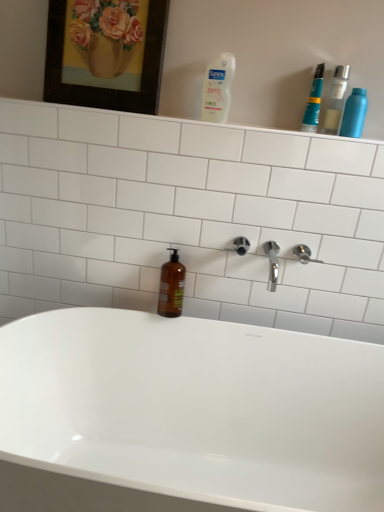
The height and width of the screenshot is (512, 384). I want to click on teal plastic toothpaste at upper right, the third mouthwash when ordered from bottom to top, so click(x=314, y=101).

Locate an element on the screen. white plastic bottle at upper center, which is the 1th cleaning product from left to right is located at coordinates (218, 88).

Describe the element at coordinates (171, 287) in the screenshot. I see `brown glass bottle at center, the first mouthwash in the bottom-to-top sequence` at that location.

What are the coordinates of `transparent plastic bottle at upper right, positioned as the second mouthwash in bottom-to-top order` in the screenshot? It's located at (336, 100).

From the image's perspective, is white plastic bottle at upper center, which is the 1th cleaning product from left to right, above white glossy shelf at upper center?

Indeed, from the image's perspective, white plastic bottle at upper center, which is the 1th cleaning product from left to right, is shown above white glossy shelf at upper center.

From a real-world perspective, which object rests below the other?

white glossy shelf at upper center is physically lower.

Looking at this image, can you confirm if white plastic bottle at upper center, which is the 1th cleaning product from left to right, is taller than white glossy shelf at upper center?

Indeed, white plastic bottle at upper center, which is the 1th cleaning product from left to right, has a greater height compared to white glossy shelf at upper center.

Which object is closer to the camera, white plastic bottle at upper center, which is the second cleaning product in right-to-left order, or white glossy shelf at upper center?

Positioned in front is white plastic bottle at upper center, which is the second cleaning product in right-to-left order.

From a real-world perspective, is white glossy bathtub at center beneath teal plastic toothpaste at upper right, the second mouthwash from the right?

Yes, from a real-world perspective, white glossy bathtub at center is below teal plastic toothpaste at upper right, the second mouthwash from the right.

Is white glossy bathtub at center oriented away from teal plastic toothpaste at upper right, the third mouthwash when ordered from bottom to top?

No, white glossy bathtub at center is not facing the opposite direction of teal plastic toothpaste at upper right, the third mouthwash when ordered from bottom to top.

Considering the sizes of objects white glossy bathtub at center and teal plastic toothpaste at upper right, the second mouthwash from the right, in the image provided, who is smaller, white glossy bathtub at center or teal plastic toothpaste at upper right, the second mouthwash from the right,?

With smaller size is teal plastic toothpaste at upper right, the second mouthwash from the right.

Looking at this image, based on their positions, is white plastic bottle at upper center, which is the 1th cleaning product from left to right, located to the left or right of white glossy bathtub at center?

white plastic bottle at upper center, which is the 1th cleaning product from left to right, is positioned on white glossy bathtub at center's right side.

Does white plastic bottle at upper center, which is the second cleaning product in right-to-left order, have a smaller size compared to white glossy bathtub at center?

Yes.

Is white glossy bathtub at center a part of white plastic bottle at upper center, which is the second cleaning product in right-to-left order?

Actually, white glossy bathtub at center is outside white plastic bottle at upper center, which is the second cleaning product in right-to-left order.

Are white plastic bottle at upper center, which is the 1th cleaning product from left to right, and white glossy bathtub at center located far from each other?

No, white plastic bottle at upper center, which is the 1th cleaning product from left to right, is not far away from white glossy bathtub at center.

In terms of width, does white plastic bottle at upper center, which is the second cleaning product in right-to-left order, look wider or thinner when compared to teal plastic toothpaste at upper right, the second mouthwash from the right?

Clearly, white plastic bottle at upper center, which is the second cleaning product in right-to-left order, has less width compared to teal plastic toothpaste at upper right, the second mouthwash from the right.

Who is more distant, white plastic bottle at upper center, which is the 1th cleaning product from left to right, or teal plastic toothpaste at upper right, which is counted as the 2th mouthwash, starting from the left?

teal plastic toothpaste at upper right, which is counted as the 2th mouthwash, starting from the left, is behind.

Is white plastic bottle at upper center, which is the second cleaning product in right-to-left order, located outside teal plastic toothpaste at upper right, the second mouthwash from the right?

Indeed, white plastic bottle at upper center, which is the second cleaning product in right-to-left order, is completely outside teal plastic toothpaste at upper right, the second mouthwash from the right.

From the image's perspective, does white plastic bottle at upper center, which is the second cleaning product in right-to-left order, appear lower than teal plastic toothpaste at upper right, the second mouthwash from the right?

No, from the image's perspective, white plastic bottle at upper center, which is the second cleaning product in right-to-left order, is not beneath teal plastic toothpaste at upper right, the second mouthwash from the right.

Who is taller, brown glass bottle at center, the first mouthwash in the bottom-to-top sequence, or wooden frame at upper left?

wooden frame at upper left.

Could wooden frame at upper left be considered to be inside brown glass bottle at center, placed as the first mouthwash when sorted from left to right?

No, wooden frame at upper left is not inside brown glass bottle at center, placed as the first mouthwash when sorted from left to right.

Who is more distant, brown glass bottle at center, the first mouthwash in the bottom-to-top sequence, or wooden frame at upper left?

brown glass bottle at center, the first mouthwash in the bottom-to-top sequence.

Between transparent plastic bottle at upper right, marked as the second mouthwash in a top-to-bottom arrangement, and white glossy shelf at upper center, which one is positioned in front?

transparent plastic bottle at upper right, marked as the second mouthwash in a top-to-bottom arrangement, is closer to the camera.

Considering the relative sizes of transparent plastic bottle at upper right, marked as the second mouthwash in a top-to-bottom arrangement, and white glossy shelf at upper center in the image provided, is transparent plastic bottle at upper right, marked as the second mouthwash in a top-to-bottom arrangement, thinner than white glossy shelf at upper center?

Indeed, transparent plastic bottle at upper right, marked as the second mouthwash in a top-to-bottom arrangement, has a lesser width compared to white glossy shelf at upper center.

Does point (327, 124) come closer to viewer compared to point (34, 106)?

Yes.

Can you see transparent plastic bottle at upper right, positioned as the second mouthwash in bottom-to-top order, touching white glossy shelf at upper center?

transparent plastic bottle at upper right, positioned as the second mouthwash in bottom-to-top order, and white glossy shelf at upper center are not in contact.

Does transparent plastic bottle at upper right, the third mouthwash positioned from the left, have a lesser height compared to wooden frame at upper left?

Correct, transparent plastic bottle at upper right, the third mouthwash positioned from the left, is not as tall as wooden frame at upper left.

Consider the image. Does transparent plastic bottle at upper right, marked as the second mouthwash in a top-to-bottom arrangement, have a larger size compared to wooden frame at upper left?

No, transparent plastic bottle at upper right, marked as the second mouthwash in a top-to-bottom arrangement, is not bigger than wooden frame at upper left.

Would you say transparent plastic bottle at upper right, the first mouthwash from the right, is to the left or to the right of wooden frame at upper left in the picture?

transparent plastic bottle at upper right, the first mouthwash from the right, is to the right of wooden frame at upper left.

You are a GUI agent. You are given a task and a screenshot of the screen. Output one action in this format:
    pyautogui.click(x=<x>, y=<y>)
    Task: Click on the shelve on the left of white plastic bottle at upper center, which is the second cleaning product in right-to-left order
    
    Given the screenshot: What is the action you would take?
    pyautogui.click(x=40, y=105)

The height and width of the screenshot is (512, 384). I want to click on mouthwash that is the 3rd object located above the white glossy bathtub at center (from the image's perspective), so click(x=314, y=101).

When comparing their distances from wooden frame at upper left, does white glossy bathtub at center or teal plastic toothpaste at upper right, the second mouthwash from the right, seem closer?

The object closer to wooden frame at upper left is teal plastic toothpaste at upper right, the second mouthwash from the right.

Considering their positions, is white plastic bottle at upper center, which is the second cleaning product in right-to-left order, positioned further to teal plastic toothpaste at upper right, marked as the 1th mouthwash in a top-to-bottom arrangement, than transparent plastic bottle at upper right, marked as the second mouthwash in a top-to-bottom arrangement?

Among the two, white plastic bottle at upper center, which is the second cleaning product in right-to-left order, is located further to teal plastic toothpaste at upper right, marked as the 1th mouthwash in a top-to-bottom arrangement.

From the image, which object appears to be nearer to white glossy bathtub at center, satin nickel shower at upper right or transparent plastic bottle at upper right, the third mouthwash positioned from the left?

satin nickel shower at upper right is closer to white glossy bathtub at center.

From the image, which object appears to be farther from white glossy bathtub at center, brown glass bottle at center, placed as the first mouthwash when sorted from left to right, or metallic blue spray can at upper right, acting as the 2th cleaning product starting from the left?

Among the two, metallic blue spray can at upper right, acting as the 2th cleaning product starting from the left, is located further to white glossy bathtub at center.

Consider the image. From the image, which object appears to be nearer to wooden frame at upper left, metallic blue spray can at upper right, acting as the 2th cleaning product starting from the left, or white plastic bottle at upper center, which is the 1th cleaning product from left to right?

Among the two, white plastic bottle at upper center, which is the 1th cleaning product from left to right, is located nearer to wooden frame at upper left.

From the image, which object appears to be farther from white plastic bottle at upper center, which is the second cleaning product in right-to-left order, white glossy bathtub at center or metallic blue spray can at upper right, which is counted as the 1th cleaning product, starting from the right?

white glossy bathtub at center is further to white plastic bottle at upper center, which is the second cleaning product in right-to-left order.

Based on their spatial positions, is white glossy bathtub at center or wooden frame at upper left closer to satin nickel shower at upper right?

The object closer to satin nickel shower at upper right is white glossy bathtub at center.

From the image, which object appears to be nearer to transparent plastic bottle at upper right, the first mouthwash from the right, white plastic bottle at upper center, which is the 1th cleaning product from left to right, or metallic blue spray can at upper right, which is counted as the 1th cleaning product, starting from the right?

Among the two, metallic blue spray can at upper right, which is counted as the 1th cleaning product, starting from the right, is located nearer to transparent plastic bottle at upper right, the first mouthwash from the right.

Where is `shelve situated between wooden frame at upper left and satin nickel shower at upper right from left to right`? Image resolution: width=384 pixels, height=512 pixels. shelve situated between wooden frame at upper left and satin nickel shower at upper right from left to right is located at coordinates (40, 105).

The image size is (384, 512). What are the coordinates of `shelve between transparent plastic bottle at upper right, marked as the second mouthwash in a top-to-bottom arrangement, and brown glass bottle at center, which appears as the third mouthwash when viewed from the top, vertically` in the screenshot? It's located at (40, 105).

The height and width of the screenshot is (512, 384). I want to click on shelve between white plastic bottle at upper center, which is the 1th cleaning product from left to right, and white glossy bathtub at center, in the vertical direction, so click(40, 105).

Find the location of a particular element. Image resolution: width=384 pixels, height=512 pixels. shelve situated between wooden frame at upper left and transparent plastic bottle at upper right, marked as the second mouthwash in a top-to-bottom arrangement, from left to right is located at coordinates (40, 105).